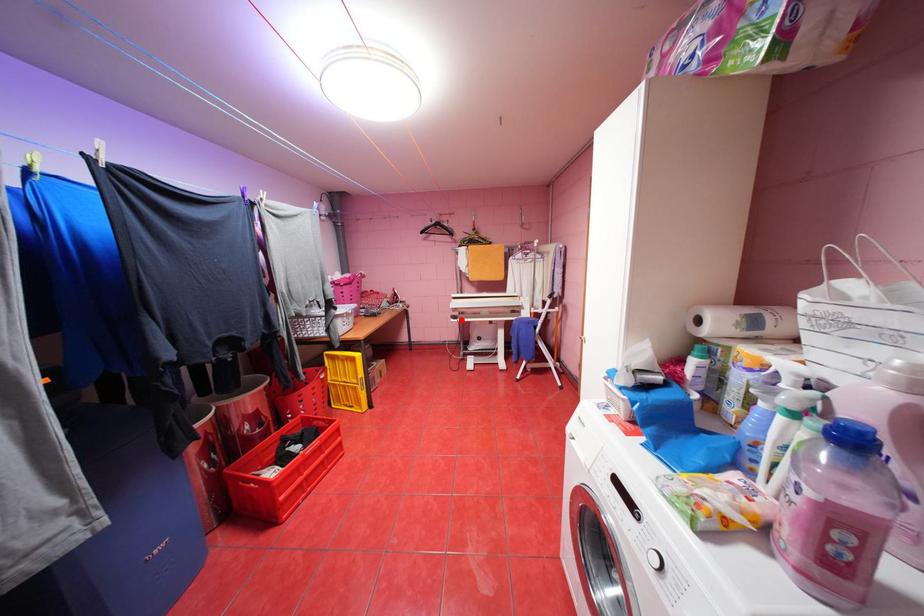
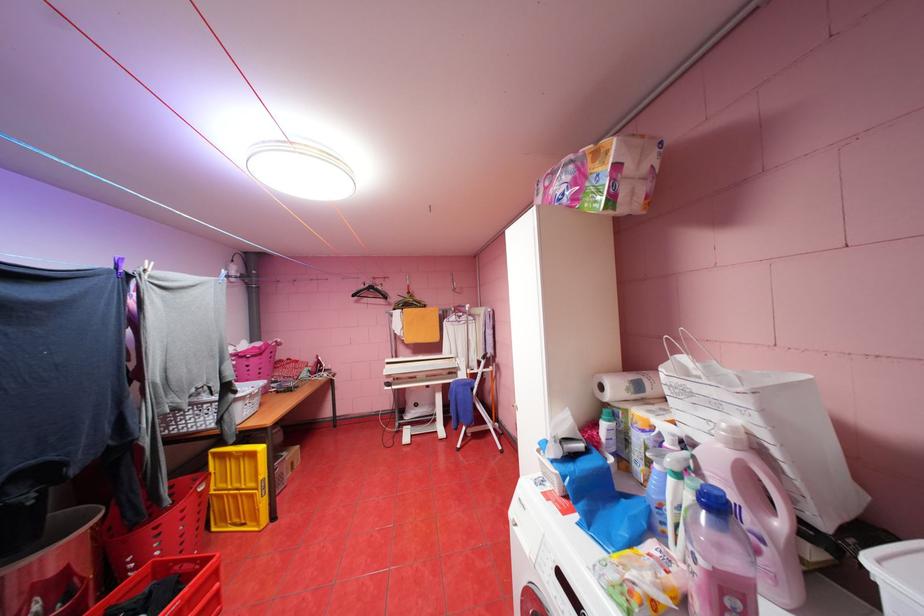
In the second image, find the point that corresponds to the highlighted location in the first image.

(395, 387)